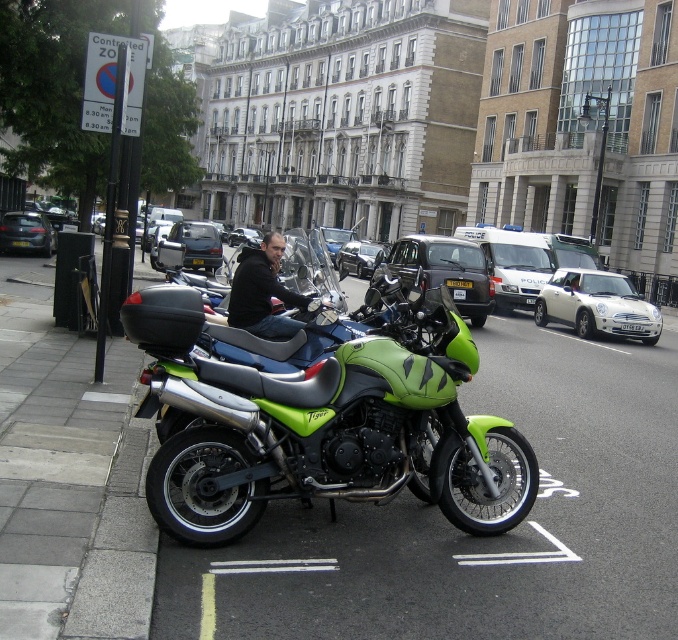
Question: Which object appears closest to the camera in this image?

Choices:
 (A) dark gray metallic car at center
 (B) matte black car at center
 (C) matte black car at left
 (D) gray concrete curb at lower left

Answer: (D)

Question: Which point is closer to the camera taking this photo?

Choices:
 (A) (235, 292)
 (B) (462, 288)

Answer: (A)

Question: Is matte black car at left positioned behind yellow metallic license plate at center?

Choices:
 (A) no
 (B) yes

Answer: (A)

Question: Which object appears closest to the camera in this image?

Choices:
 (A) yellow metallic license plate at center
 (B) gray concrete curb at lower left
 (C) matte black car at center

Answer: (B)

Question: Is black leather jacket at center bigger than matte black car at center?

Choices:
 (A) no
 (B) yes

Answer: (A)

Question: Can you confirm if gray concrete curb at lower left is smaller than white matte car at center-right?

Choices:
 (A) no
 (B) yes

Answer: (B)